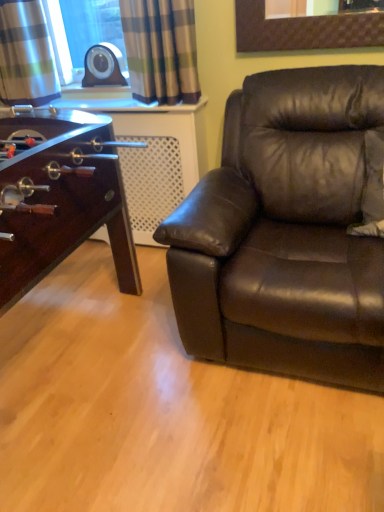
Where is `free point below plaid fabric curtain at upper left, acting as the 1th curtain starting from the right (from a real-world perspective)`? Image resolution: width=384 pixels, height=512 pixels. free point below plaid fabric curtain at upper left, acting as the 1th curtain starting from the right (from a real-world perspective) is located at coordinates tap(159, 106).